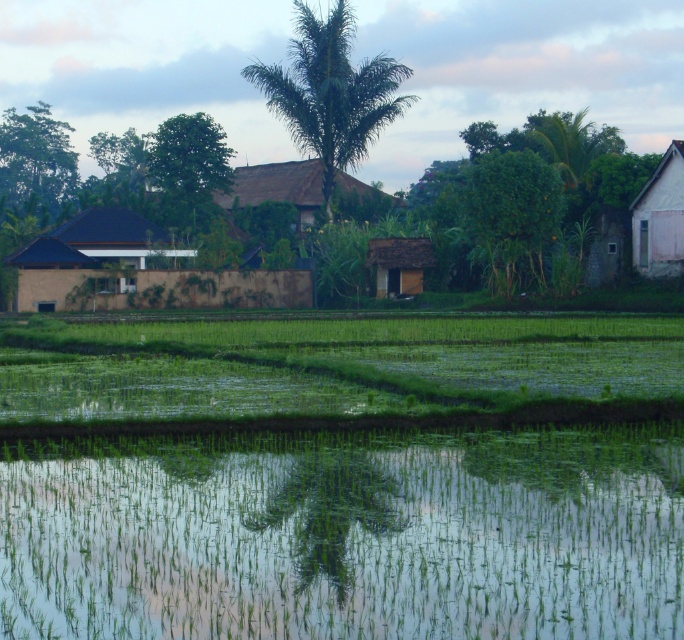
You are a visitor in this rural area and want to take a photo of both the brown textured hut at left and the brown thatched hut at center. Which direction should you face to have both huts in the frame?

You should face towards the right side of the scene so that both the brown textured hut at left and the brown thatched hut at center are visible in your camera frame. Since the brown textured hut at left is to the left of the brown thatched hut at center, positioning yourself facing right ensures both structures are captured.

You are a farmer planning to plant crops in the green grassy rice field at lower center and the white painted wood hut at right. Which area has a greater width to accommodate more plants?

The green grassy rice field at lower center has a greater width than the white painted wood hut at right, so it can accommodate more plants.

You are a farmer standing at the edge of the green grassy rice field at lower center and want to reach the white painted wood hut at right. Which direction should you move to get there?

The green grassy rice field at lower center is to the left of the white painted wood hut at right, so you should move to the right to reach the white painted wood hut at right.